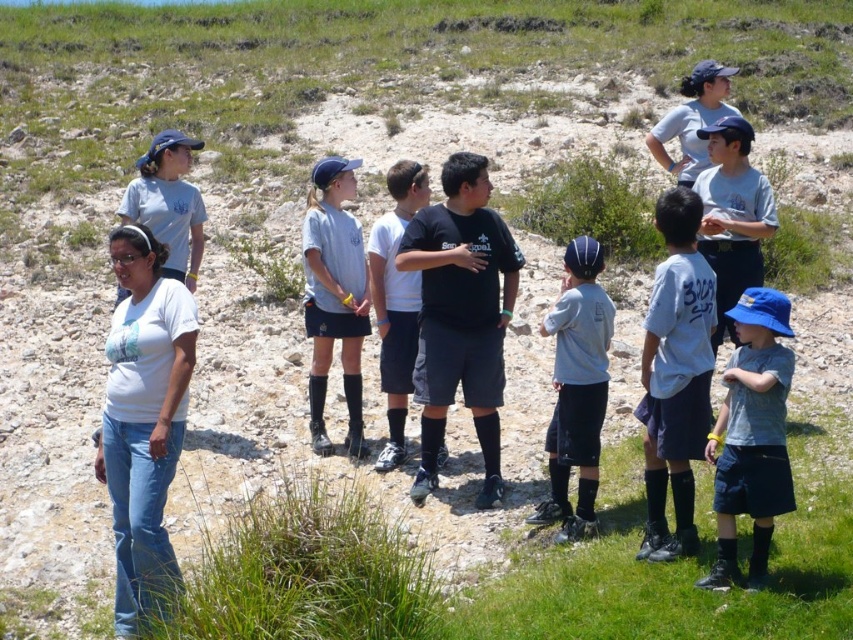
Based on the photo, does white matte t-shirt at lower left have a lesser width compared to blue cotton shirt at lower right?

No, white matte t-shirt at lower left is not thinner than blue cotton shirt at lower right.

Can you confirm if white matte t-shirt at lower left is positioned above blue cotton shirt at lower right?

Yes, white matte t-shirt at lower left is above blue cotton shirt at lower right.

Is point (158, 518) behind point (780, 472)?

Yes, point (158, 518) is farther from viewer.

Find the location of a particular element. white matte t-shirt at lower left is located at coordinates (143, 417).

Is blue cotton shirt at lower right bigger than gray matte shirt at center?

No, blue cotton shirt at lower right is not bigger than gray matte shirt at center.

Is point (735, 320) farther from viewer compared to point (549, 456)?

No, (735, 320) is in front of (549, 456).

At what (x,y) coordinates should I click in order to perform the action: click on blue cotton shirt at lower right. Please return your answer as a coordinate pair (x, y). This screenshot has height=640, width=853. Looking at the image, I should click on (751, 436).

Is point (776, 330) behind point (418, 288)?

No, (776, 330) is closer to viewer.

Is blue cotton shirt at lower right bigger than black matte shorts at center?

Incorrect, blue cotton shirt at lower right is not larger than black matte shorts at center.

You are a GUI agent. You are given a task and a screenshot of the screen. Output one action in this format:
    pyautogui.click(x=<x>, y=<y>)
    Task: Click on the blue cotton shirt at lower right
    The width and height of the screenshot is (853, 640).
    Given the screenshot: What is the action you would take?
    pyautogui.click(x=751, y=436)